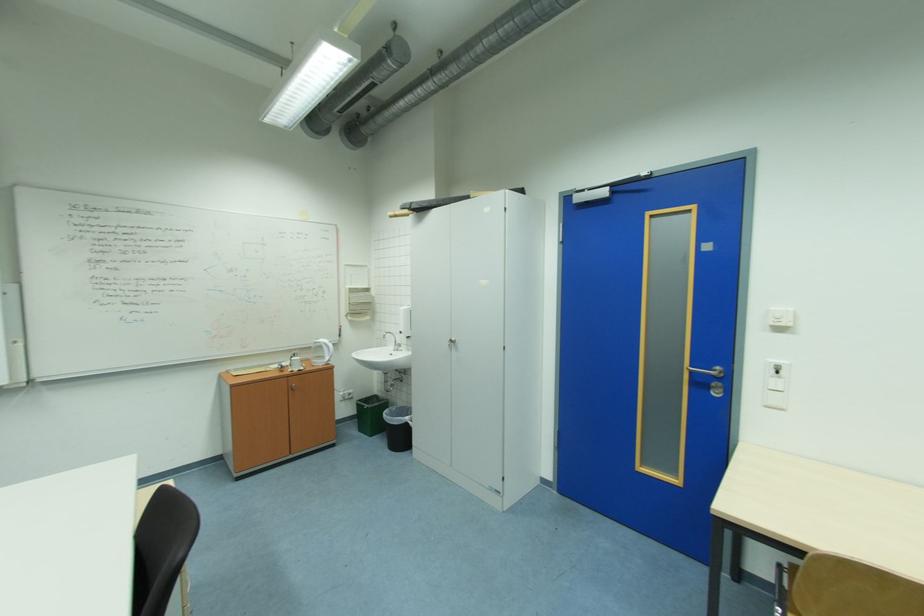
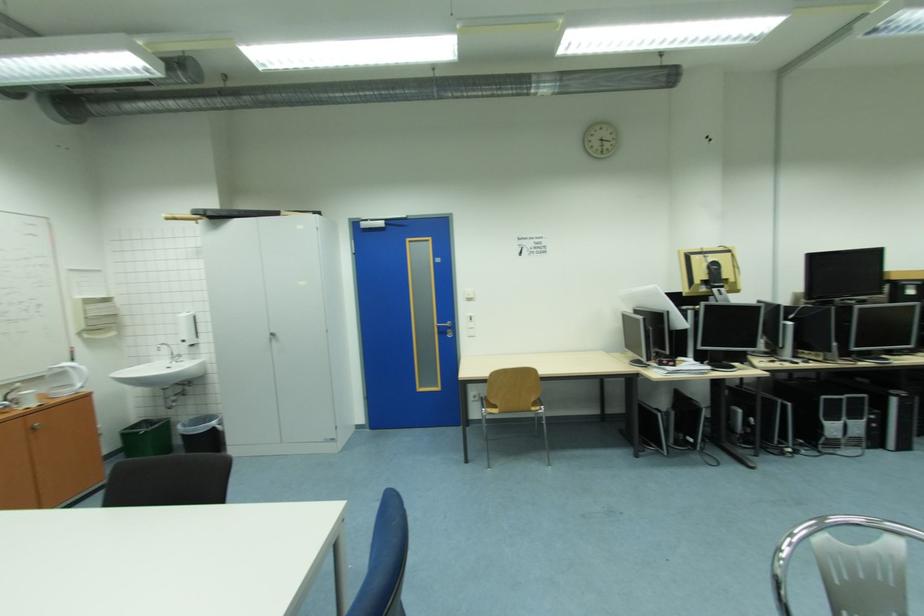
Question: I am providing you with two images of the same scene from different viewpoints. Please identify which objects are invisible in image2.

Choices:
 (A) paper towel dispenser
 (B) black trash can
 (C) blue door handle
 (D) none of these

Answer: (D)